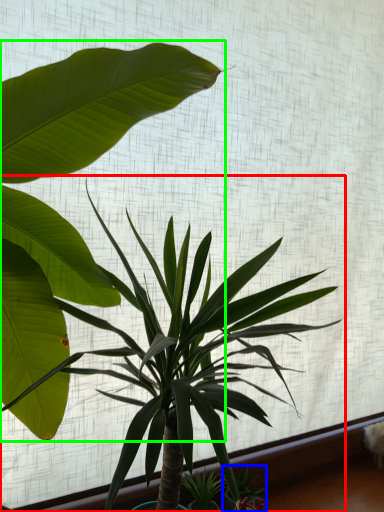
Question: Considering the real-world distances, which object is closest to houseplant (highlighted by a red box)? plant (highlighted by a blue box) or houseplant (highlighted by a green box).

Choices:
 (A) plant
 (B) houseplant

Answer: (B)